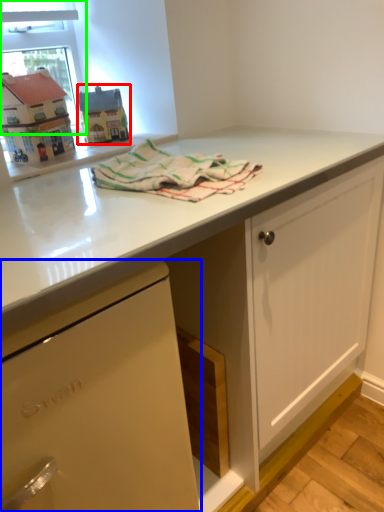
Question: Considering the real-world distances, which object is closest to appliance (highlighted by a red box)? cabinetry (highlighted by a blue box) or window screen (highlighted by a green box).

Choices:
 (A) cabinetry
 (B) window screen

Answer: (B)